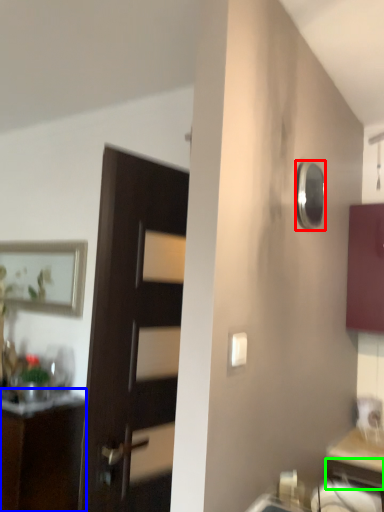
Question: Which is farther away from mirror (highlighted by a red box)? cabinetry (highlighted by a blue box) or drawer (highlighted by a green box)?

Choices:
 (A) cabinetry
 (B) drawer

Answer: (A)